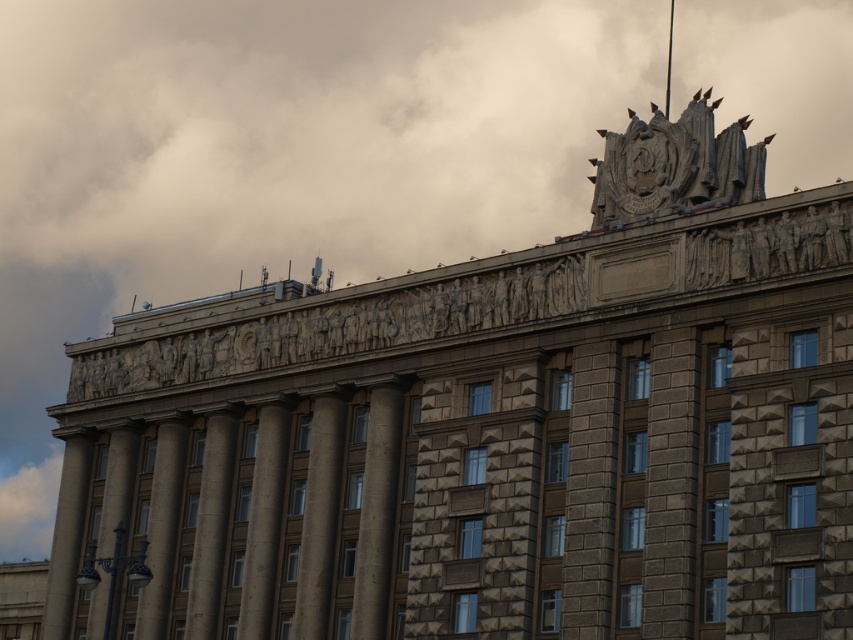
You are an architect examining the building facade. You notice a point marked at coordinates (671, 484). What object is located at that point?

The point at coordinates (671, 484) indicates a gray stone pillar at center.

You are standing in front of the grand building and notice a specific point marked at coordinates (671, 484). Based on the scene description, can you identify which architectural feature this point is located on?

The point at coordinates (671, 484) is located on the gray stone pillar at center.